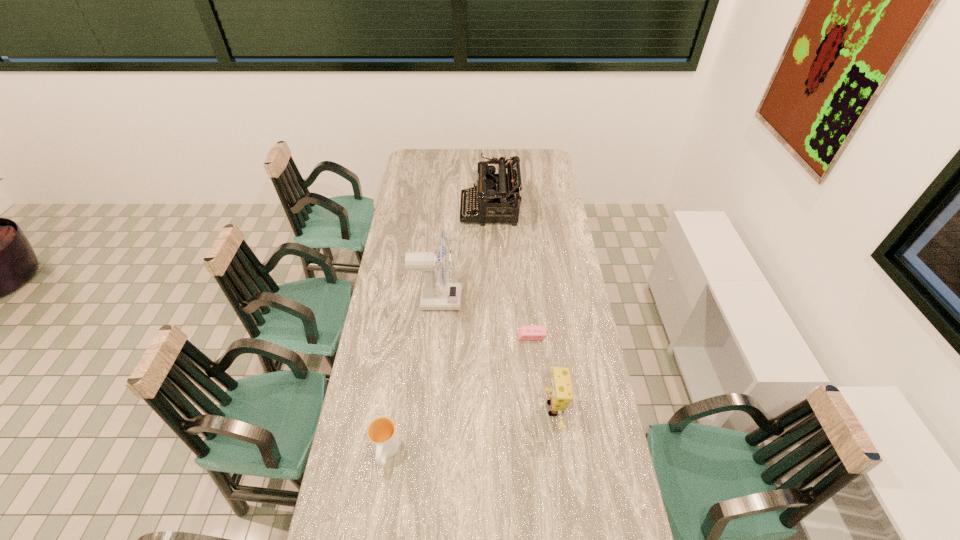
Locate an element on the screen. vacant area located 0.180m on the keyboard of the second tallest object is located at coordinates (424, 210).

Locate an element on the screen. free space located on the keyboard of the second tallest object is located at coordinates (396, 210).

The width and height of the screenshot is (960, 540). What are the coordinates of `vacant space located on the face of the third tallest object` in the screenshot? It's located at (450, 409).

Image resolution: width=960 pixels, height=540 pixels. Identify the location of vacant space located 0.330m on the face of the third tallest object. (442, 409).

Locate an element on the screen. This screenshot has height=540, width=960. vacant region located 0.280m on the face of the third tallest object is located at coordinates (457, 409).

Image resolution: width=960 pixels, height=540 pixels. I want to click on vacant position located with the handle on the side of the cup, so click(x=373, y=534).

I want to click on vacant space located on the right of the shortest object, so click(x=586, y=335).

In order to click on fan present at the left edge in this screenshot , I will do `click(434, 296)`.

Locate an element on the screen. The image size is (960, 540). cup located in the left edge section of the desktop is located at coordinates (382, 433).

Image resolution: width=960 pixels, height=540 pixels. Find the location of `object that is at the right edge`. object that is at the right edge is located at coordinates (561, 393).